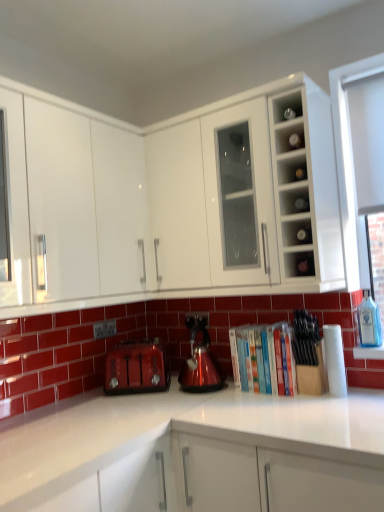
Question: Relative to matte red toaster at lower left, is white glossy cabinet at upper left, which is the 2th cabinetry in right-to-left order, in front or behind?

Choices:
 (A) front
 (B) behind

Answer: (A)

Question: In the image, is white glossy cabinet at upper left, which is the 2th cabinetry in right-to-left order, on the left side or the right side of matte red toaster at lower left?

Choices:
 (A) left
 (B) right

Answer: (A)

Question: Based on their relative distances, which object is farther from the white glossy cabinet at upper center, the 1th cabinetry in the right-to-left sequence?

Choices:
 (A) clear glass bottles at upper right, marked as the second shelf in a top-to-bottom arrangement
 (B) matte glass shelf at upper right, which is the 1th shelf from bottom to top
 (C) clear glass window at upper right
 (D) matte red toaster at lower left
 (E) white glossy cabinet at upper left, the 1th cabinetry from the left

Answer: (D)

Question: Based on their relative distances, which object is farther from the shiny metallic kettle at center?

Choices:
 (A) hardcover books at center
 (B) matte red toaster at lower left
 (C) matte glass shelf at upper right, which is the 1th shelf from bottom to top
 (D) matte glass bottles at upper right, positioned as the first shelf in top-to-bottom order
 (E) white glossy cabinet at upper center, the 1th cabinetry in the right-to-left sequence

Answer: (D)